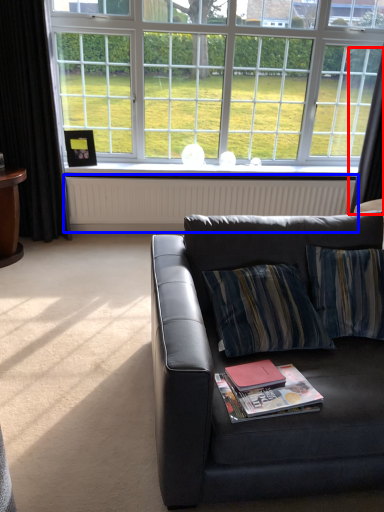
Question: Which of the following is the farthest to the observer, curtain (highlighted by a red box) or radiator (highlighted by a blue box)?

Choices:
 (A) curtain
 (B) radiator

Answer: (B)